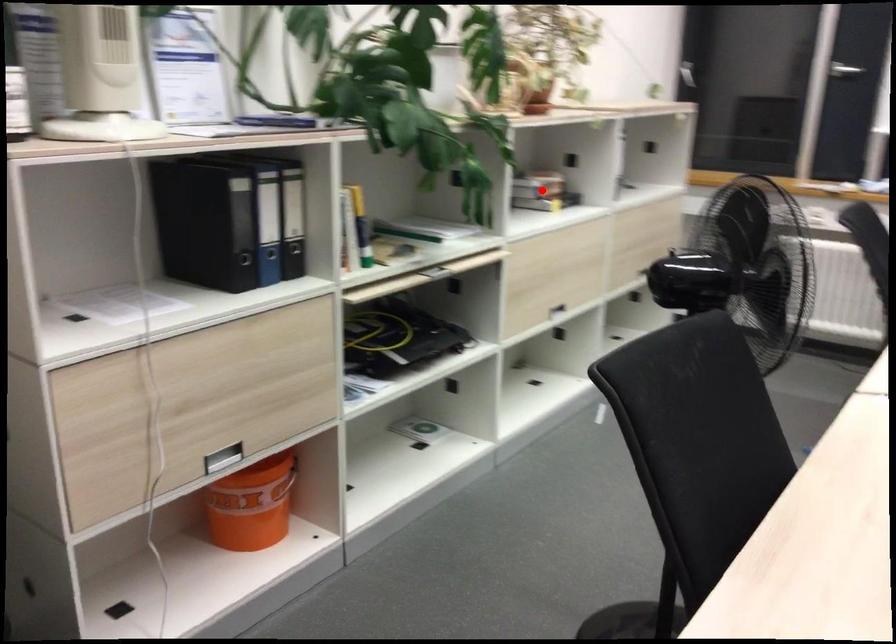
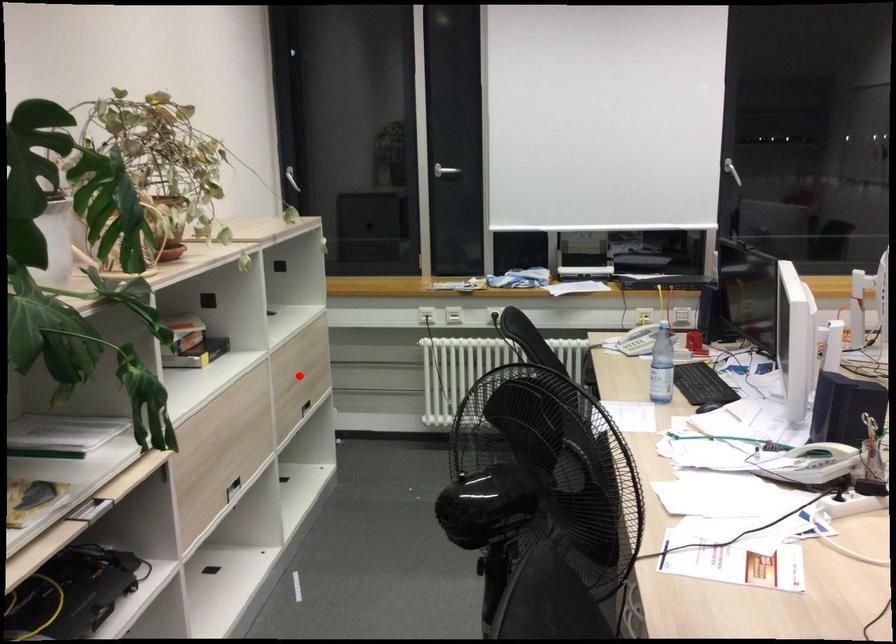
I am providing you with two images of the same scene from different viewpoints. A red point is marked on the first image and another point is marked on the second image. Are the points marked in image1 and image2 representing the same 3D position?

No